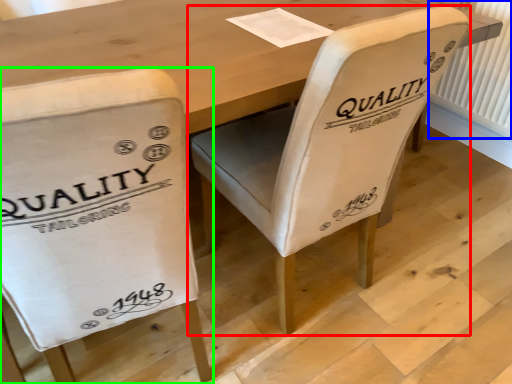
Question: Considering the real-world distances, which object is closest to chair (highlighted by a red box)? radiator (highlighted by a blue box) or chair (highlighted by a green box).

Choices:
 (A) radiator
 (B) chair

Answer: (B)